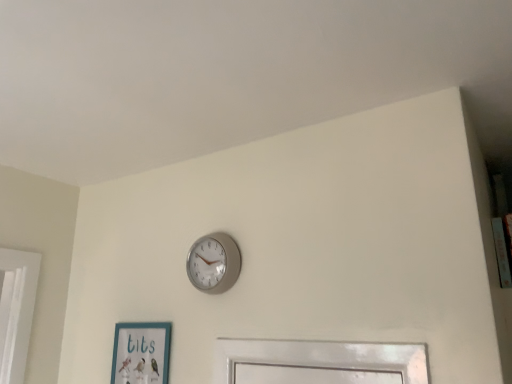
Find the location of `teal matte picture frame at lower left`. teal matte picture frame at lower left is located at coordinates (141, 353).

The image size is (512, 384). What do you see at coordinates (141, 353) in the screenshot?
I see `teal matte picture frame at lower left` at bounding box center [141, 353].

What do you see at coordinates (214, 263) in the screenshot? I see `silver metallic clock at upper center` at bounding box center [214, 263].

In order to face silver metallic clock at upper center, should I rotate leftwards or rightwards?

You should look left and rotate roughly 6.116 degrees.

Find the location of a particular element. This screenshot has height=384, width=512. silver metallic clock at upper center is located at coordinates (214, 263).

Where is `teal matte picture frame at lower left`? This screenshot has height=384, width=512. teal matte picture frame at lower left is located at coordinates (141, 353).

Is silver metallic clock at upper center at the right side of teal matte picture frame at lower left?

Indeed, silver metallic clock at upper center is positioned on the right side of teal matte picture frame at lower left.

In the scene shown: In the image, is silver metallic clock at upper center positioned in front of or behind teal matte picture frame at lower left?

Visually, silver metallic clock at upper center is located in front of teal matte picture frame at lower left.

Is point (233, 259) behind point (129, 365)?

That is False.

From the image's perspective, is silver metallic clock at upper center located beneath teal matte picture frame at lower left?

Actually, silver metallic clock at upper center appears above teal matte picture frame at lower left in the image.

From a real-world perspective, is silver metallic clock at upper center physically located above or below teal matte picture frame at lower left?

silver metallic clock at upper center is situated higher than teal matte picture frame at lower left in the real world.

Considering the relative sizes of silver metallic clock at upper center and teal matte picture frame at lower left in the image provided, is silver metallic clock at upper center wider than teal matte picture frame at lower left?

Yes, silver metallic clock at upper center is wider than teal matte picture frame at lower left.

Is silver metallic clock at upper center shorter than teal matte picture frame at lower left?

Yes.

Considering the relative sizes of silver metallic clock at upper center and teal matte picture frame at lower left in the image provided, is silver metallic clock at upper center bigger than teal matte picture frame at lower left?

Actually, silver metallic clock at upper center might be smaller than teal matte picture frame at lower left.

Is teal matte picture frame at lower left completely or partially inside silver metallic clock at upper center?

No, silver metallic clock at upper center does not contain teal matte picture frame at lower left.

Is silver metallic clock at upper center far away from teal matte picture frame at lower left?

silver metallic clock at upper center is actually quite close to teal matte picture frame at lower left.

Could you tell me if silver metallic clock at upper center is turned towards teal matte picture frame at lower left?

No, silver metallic clock at upper center does not turn towards teal matte picture frame at lower left.

How many degrees apart are the facing directions of silver metallic clock at upper center and teal matte picture frame at lower left?

0.000344 degrees.

This screenshot has height=384, width=512. Find the location of `picture frame behind the silver metallic clock at upper center`. picture frame behind the silver metallic clock at upper center is located at coordinates (141, 353).

Which object is positioned more to the right, teal matte picture frame at lower left or silver metallic clock at upper center?

silver metallic clock at upper center.

Considering the relative positions of teal matte picture frame at lower left and silver metallic clock at upper center in the image provided, is teal matte picture frame at lower left behind silver metallic clock at upper center?

That is True.

Between point (119, 346) and point (210, 243), which one is positioned in front?

The point (210, 243) is closer to the camera.

Consider the image. From the image's perspective, is teal matte picture frame at lower left on silver metallic clock at upper center?

Incorrect, from the image's perspective, teal matte picture frame at lower left is lower than silver metallic clock at upper center.

From a real-world perspective, does teal matte picture frame at lower left stand above silver metallic clock at upper center?

No, from a real-world perspective, teal matte picture frame at lower left is not above silver metallic clock at upper center.

Between teal matte picture frame at lower left and silver metallic clock at upper center, which one has smaller width?

Thinner between the two is teal matte picture frame at lower left.

Does teal matte picture frame at lower left have a lesser height compared to silver metallic clock at upper center?

Incorrect, the height of teal matte picture frame at lower left does not fall short of that of silver metallic clock at upper center.

Looking at this image, considering the relative sizes of teal matte picture frame at lower left and silver metallic clock at upper center in the image provided, is teal matte picture frame at lower left smaller than silver metallic clock at upper center?

No, teal matte picture frame at lower left is not smaller than silver metallic clock at upper center.

Is silver metallic clock at upper center surrounded by teal matte picture frame at lower left?

No, teal matte picture frame at lower left does not contain silver metallic clock at upper center.

Is the surface of teal matte picture frame at lower left in direct contact with silver metallic clock at upper center?

No, teal matte picture frame at lower left is not making contact with silver metallic clock at upper center.

Is teal matte picture frame at lower left looking in the opposite direction of silver metallic clock at upper center?

No, teal matte picture frame at lower left's orientation is not away from silver metallic clock at upper center.

How many degrees apart are the facing directions of teal matte picture frame at lower left and silver metallic clock at upper center?

The angle between the facing direction of teal matte picture frame at lower left and the facing direction of silver metallic clock at upper center is 0.000344 degrees.

I want to click on wall clock above the teal matte picture frame at lower left (from a real-world perspective), so click(214, 263).

Find the location of a particular element. This screenshot has height=384, width=512. picture frame that is under the silver metallic clock at upper center (from a real-world perspective) is located at coordinates (141, 353).

Identify the location of wall clock in front of the teal matte picture frame at lower left. The height and width of the screenshot is (384, 512). (214, 263).